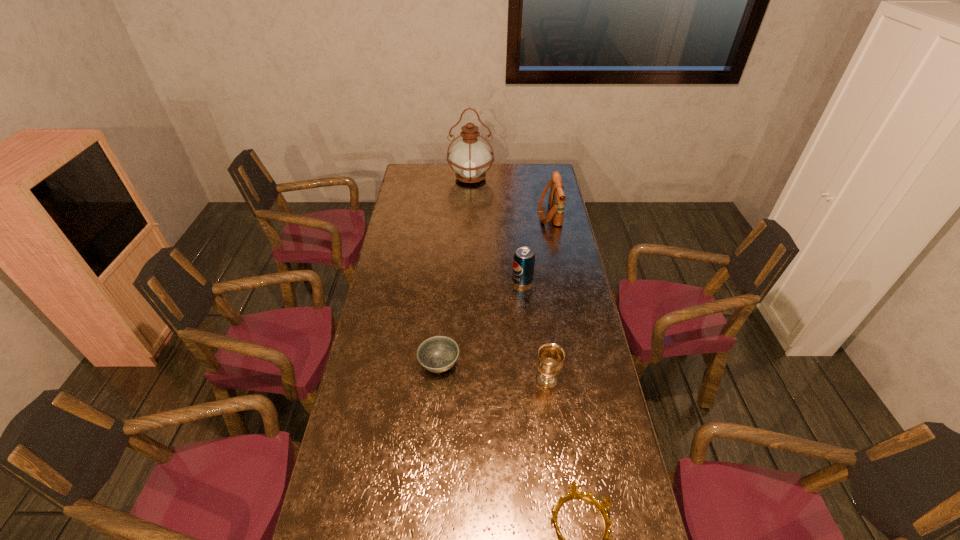
Locate an element on the screen. This screenshot has width=960, height=540. vacant space that satisfies the following two spatial constraints: 1. on the front side of the oil lamp; 2. on the left side of the soda can is located at coordinates (468, 281).